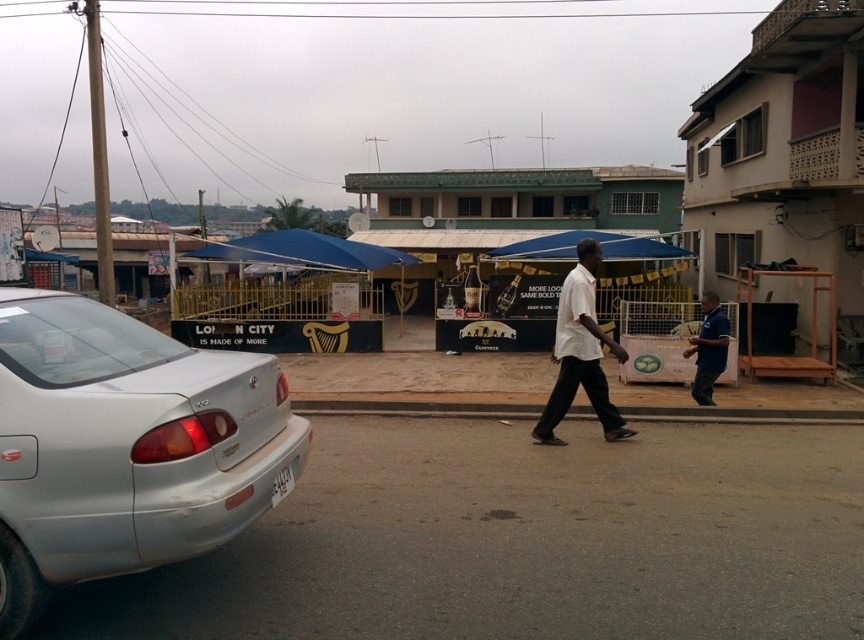
Question: Which point is farther to the camera?

Choices:
 (A) silver metallic sedan at left
 (B) white matte shirt at center
 (C) dark blue shirt at right

Answer: (C)

Question: Is white matte shirt at center above dark blue shirt at right?

Choices:
 (A) no
 (B) yes

Answer: (B)

Question: Which of these objects is positioned farthest from the silver metallic sedan at left?

Choices:
 (A) dark blue shirt at right
 (B) white matte shirt at center

Answer: (A)

Question: Which point is farther from the camera taking this photo?

Choices:
 (A) [701, 362]
 (B) [583, 323]
 (C) [49, 496]

Answer: (A)

Question: Can you confirm if white matte shirt at center is positioned below dark blue shirt at right?

Choices:
 (A) no
 (B) yes

Answer: (A)

Question: Considering the relative positions of silver metallic sedan at left and white matte shirt at center in the image provided, where is silver metallic sedan at left located with respect to white matte shirt at center?

Choices:
 (A) above
 (B) below

Answer: (B)